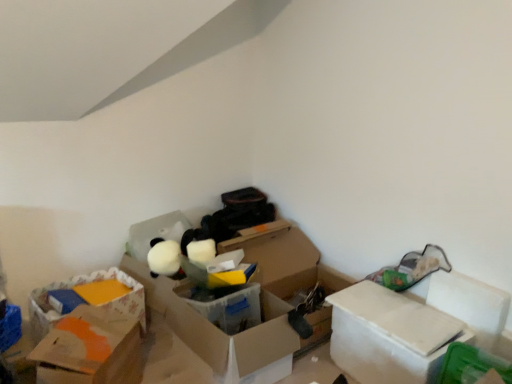
Find the location of `translucent plastic box at center, which ranks as the second box in left-to-right order`. translucent plastic box at center, which ranks as the second box in left-to-right order is located at coordinates (224, 333).

Image resolution: width=512 pixels, height=384 pixels. What do you see at coordinates (224, 333) in the screenshot? I see `translucent plastic box at center, which ranks as the second box in left-to-right order` at bounding box center [224, 333].

This screenshot has width=512, height=384. What do you see at coordinates (100, 306) in the screenshot? I see `cardboard box at left, which is counted as the 1th storage box, starting from the left` at bounding box center [100, 306].

What are the coordinates of `white cardboard box at right, the 1th box positioned from the right` in the screenshot? It's located at (390, 335).

Which object is wider, green plastic storage box at lower right, which is the first storage box in front-to-back order, or cardboard box at left, acting as the second storage box starting from the right?

cardboard box at left, acting as the second storage box starting from the right.

In the image, is green plastic storage box at lower right, which is the first storage box in front-to-back order, on the left side or the right side of cardboard box at left, acting as the second storage box starting from the right?

Clearly, green plastic storage box at lower right, which is the first storage box in front-to-back order, is on the right of cardboard box at left, acting as the second storage box starting from the right, in the image.

Can you tell me how much green plastic storage box at lower right, the 1th storage box when ordered from right to left, and cardboard box at left, marked as the second storage box in a front-to-back arrangement, differ in facing direction?

The angle between the facing direction of green plastic storage box at lower right, the 1th storage box when ordered from right to left, and the facing direction of cardboard box at left, marked as the second storage box in a front-to-back arrangement, is 90.6 degrees.

Can you confirm if green plastic storage box at lower right, the 1th storage box when ordered from right to left, is smaller than cardboard box at left, marked as the second storage box in a front-to-back arrangement?

Correct, green plastic storage box at lower right, the 1th storage box when ordered from right to left, occupies less space than cardboard box at left, marked as the second storage box in a front-to-back arrangement.

From the image's perspective, count 1st boxs downward from the cardboard box at left, placed as the 1th storage box when sorted from back to front, and point to it. Please provide its 2D coordinates.

[(224, 333)]

From a real-world perspective, is cardboard box at left, placed as the 1th storage box when sorted from back to front, under translucent plastic box at center, which ranks as the second box in left-to-right order?

No.

Does cardboard box at left, which is counted as the 1th storage box, starting from the left, turn towards translucent plastic box at center, the second box positioned from the right?

Yes, cardboard box at left, which is counted as the 1th storage box, starting from the left, is turned towards translucent plastic box at center, the second box positioned from the right.

Which is correct: white cardboard box at right, the 1th box positioned from the right, is inside translucent plastic box at center, which ranks as the second box in left-to-right order, or outside of it?

white cardboard box at right, the 1th box positioned from the right, is spatially situated outside translucent plastic box at center, which ranks as the second box in left-to-right order.

Is white cardboard box at right, the third box in the left-to-right sequence, wider or thinner than translucent plastic box at center, which ranks as the second box in left-to-right order?

In the image, white cardboard box at right, the third box in the left-to-right sequence, appears to be more narrow than translucent plastic box at center, which ranks as the second box in left-to-right order.

Does white cardboard box at right, the 1th box positioned from the right, come behind translucent plastic box at center, the second box positioned from the right?

No.

Is white cardboard box at right, the third box in the left-to-right sequence, oriented towards translucent plastic box at center, which ranks as the second box in left-to-right order?

No, white cardboard box at right, the third box in the left-to-right sequence, is not turned towards translucent plastic box at center, which ranks as the second box in left-to-right order.

Can you confirm if green plastic storage box at lower right, the 1th storage box when ordered from right to left, is bigger than translucent plastic box at center, which ranks as the second box in left-to-right order?

No.

From the image's perspective, does green plastic storage box at lower right, placed as the 2th storage box when sorted from back to front, appear lower than translucent plastic box at center, the second box positioned from the right?

Yes, from the image's perspective, green plastic storage box at lower right, placed as the 2th storage box when sorted from back to front, is beneath translucent plastic box at center, the second box positioned from the right.

Consider the image. Relative to translucent plastic box at center, the second box positioned from the right, is green plastic storage box at lower right, the 1th storage box when ordered from right to left, in front or behind?

In the image, green plastic storage box at lower right, the 1th storage box when ordered from right to left, appears in front of translucent plastic box at center, the second box positioned from the right.

From their relative heights in the image, would you say green plastic storage box at lower right, placed as the 2th storage box when sorted from back to front, is taller or shorter than translucent plastic box at center, which ranks as the second box in left-to-right order?

Considering their sizes, green plastic storage box at lower right, placed as the 2th storage box when sorted from back to front, has less height than translucent plastic box at center, which ranks as the second box in left-to-right order.

Is point (227, 351) more distant than point (140, 344)?

No, (227, 351) is closer to viewer.

Is translucent plastic box at center, the second box positioned from the right, touching orange cardboard box at lower left, the 1th box in the left-to-right sequence?

translucent plastic box at center, the second box positioned from the right, is not next to orange cardboard box at lower left, the 1th box in the left-to-right sequence, and they're not touching.

Considering the sizes of objects translucent plastic box at center, which ranks as the second box in left-to-right order, and orange cardboard box at lower left, positioned as the third box in right-to-left order, in the image provided, who is thinner, translucent plastic box at center, which ranks as the second box in left-to-right order, or orange cardboard box at lower left, positioned as the third box in right-to-left order,?

orange cardboard box at lower left, positioned as the third box in right-to-left order.

Based on the photo, from the image's perspective, is cardboard box at left, placed as the 1th storage box when sorted from back to front, on orange cardboard box at lower left, positioned as the third box in right-to-left order?

Yes, from the image's perspective, cardboard box at left, placed as the 1th storage box when sorted from back to front, is above orange cardboard box at lower left, positioned as the third box in right-to-left order.

In terms of size, does cardboard box at left, placed as the 1th storage box when sorted from back to front, appear bigger or smaller than orange cardboard box at lower left, positioned as the third box in right-to-left order?

In the image, cardboard box at left, placed as the 1th storage box when sorted from back to front, appears to be smaller than orange cardboard box at lower left, positioned as the third box in right-to-left order.

Considering the positions of objects cardboard box at left, acting as the second storage box starting from the right, and orange cardboard box at lower left, positioned as the third box in right-to-left order, in the image provided, who is more to the right, cardboard box at left, acting as the second storage box starting from the right, or orange cardboard box at lower left, positioned as the third box in right-to-left order,?

Positioned to the right is orange cardboard box at lower left, positioned as the third box in right-to-left order.

Relative to orange cardboard box at lower left, positioned as the third box in right-to-left order, is cardboard box at left, acting as the second storage box starting from the right, in front or behind?

Clearly, cardboard box at left, acting as the second storage box starting from the right, is behind orange cardboard box at lower left, positioned as the third box in right-to-left order.

In terms of size, does orange cardboard box at lower left, positioned as the third box in right-to-left order, appear bigger or smaller than translucent plastic box at center, which ranks as the second box in left-to-right order?

Clearly, orange cardboard box at lower left, positioned as the third box in right-to-left order, is smaller in size than translucent plastic box at center, which ranks as the second box in left-to-right order.

Which object is thinner, orange cardboard box at lower left, positioned as the third box in right-to-left order, or translucent plastic box at center, the second box positioned from the right?

orange cardboard box at lower left, positioned as the third box in right-to-left order, is thinner.

In the scene shown: Could you tell me if orange cardboard box at lower left, the 1th box in the left-to-right sequence, is turned towards translucent plastic box at center, which ranks as the second box in left-to-right order?

Yes, orange cardboard box at lower left, the 1th box in the left-to-right sequence, is oriented towards translucent plastic box at center, which ranks as the second box in left-to-right order.

In the scene shown: Which point is more forward, (86, 359) or (190, 332)?

The point (86, 359) is closer.

Identify the location of storage box above the cardboard box at left, placed as the 1th storage box when sorted from back to front (from a real-world perspective). The width and height of the screenshot is (512, 384). (471, 365).

From the image's perspective, which box is the 1st one below the cardboard box at left, acting as the second storage box starting from the right? Please provide its 2D coordinates.

[(224, 333)]

From the image, which object appears to be nearer to orange cardboard box at lower left, the 1th box in the left-to-right sequence, cardboard box at left, placed as the 1th storage box when sorted from back to front, or green plastic storage box at lower right, which is the first storage box in front-to-back order?

cardboard box at left, placed as the 1th storage box when sorted from back to front, is positioned closer to the anchor orange cardboard box at lower left, the 1th box in the left-to-right sequence.

Estimate the real-world distances between objects in this image. Which object is further from translucent plastic box at center, the second box positioned from the right, orange cardboard box at lower left, the 1th box in the left-to-right sequence, or white cardboard box at right, the third box in the left-to-right sequence?

white cardboard box at right, the third box in the left-to-right sequence, lies further to translucent plastic box at center, the second box positioned from the right, than the other object.

When comparing their distances from orange cardboard box at lower left, positioned as the third box in right-to-left order, does cardboard box at left, placed as the 1th storage box when sorted from back to front, or white cardboard box at right, the third box in the left-to-right sequence, seem further?

Among the two, white cardboard box at right, the third box in the left-to-right sequence, is located further to orange cardboard box at lower left, positioned as the third box in right-to-left order.

Looking at the image, which one is located closer to translucent plastic box at center, the second box positioned from the right, cardboard box at left, placed as the 1th storage box when sorted from back to front, or green plastic storage box at lower right, the 1th storage box when ordered from right to left?

Based on the image, cardboard box at left, placed as the 1th storage box when sorted from back to front, appears to be nearer to translucent plastic box at center, the second box positioned from the right.

From the image, which object appears to be nearer to translucent plastic box at center, the second box positioned from the right, orange cardboard box at lower left, positioned as the third box in right-to-left order, or green plastic storage box at lower right, marked as the 2th storage box in a left-to-right arrangement?

orange cardboard box at lower left, positioned as the third box in right-to-left order.

Considering their positions, is cardboard box at left, acting as the second storage box starting from the right, positioned closer to translucent plastic box at center, the second box positioned from the right, than orange cardboard box at lower left, positioned as the third box in right-to-left order?

cardboard box at left, acting as the second storage box starting from the right, lies closer to translucent plastic box at center, the second box positioned from the right, than the other object.

Looking at the image, which one is located further to white cardboard box at right, the 1th box positioned from the right, translucent plastic box at center, the second box positioned from the right, or orange cardboard box at lower left, the 1th box in the left-to-right sequence?

orange cardboard box at lower left, the 1th box in the left-to-right sequence, lies further to white cardboard box at right, the 1th box positioned from the right, than the other object.

Estimate the real-world distances between objects in this image. Which object is further from white cardboard box at right, the 1th box positioned from the right, orange cardboard box at lower left, positioned as the third box in right-to-left order, or translucent plastic box at center, the second box positioned from the right?

Among the two, orange cardboard box at lower left, positioned as the third box in right-to-left order, is located further to white cardboard box at right, the 1th box positioned from the right.

I want to click on box between translucent plastic box at center, which ranks as the second box in left-to-right order, and green plastic storage box at lower right, the 1th storage box when ordered from right to left, so click(390, 335).

At what (x,y) coordinates should I click in order to perform the action: click on box between cardboard box at left, which is counted as the 1th storage box, starting from the left, and translucent plastic box at center, which ranks as the second box in left-to-right order, in the horizontal direction. Please return your answer as a coordinate pair (x, y). Looking at the image, I should click on (90, 349).

This screenshot has height=384, width=512. I want to click on box between orange cardboard box at lower left, positioned as the third box in right-to-left order, and white cardboard box at right, the 1th box positioned from the right, in the horizontal direction, so click(224, 333).